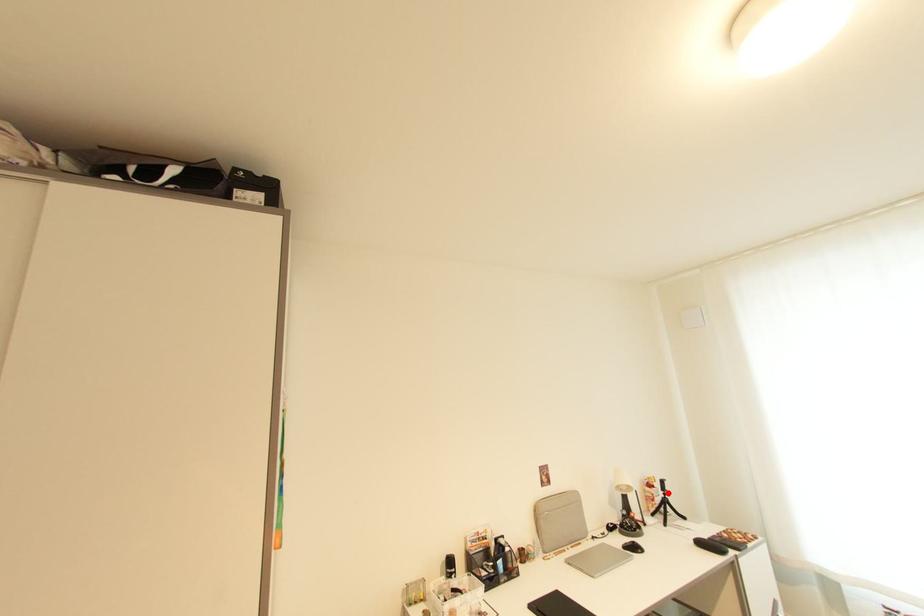
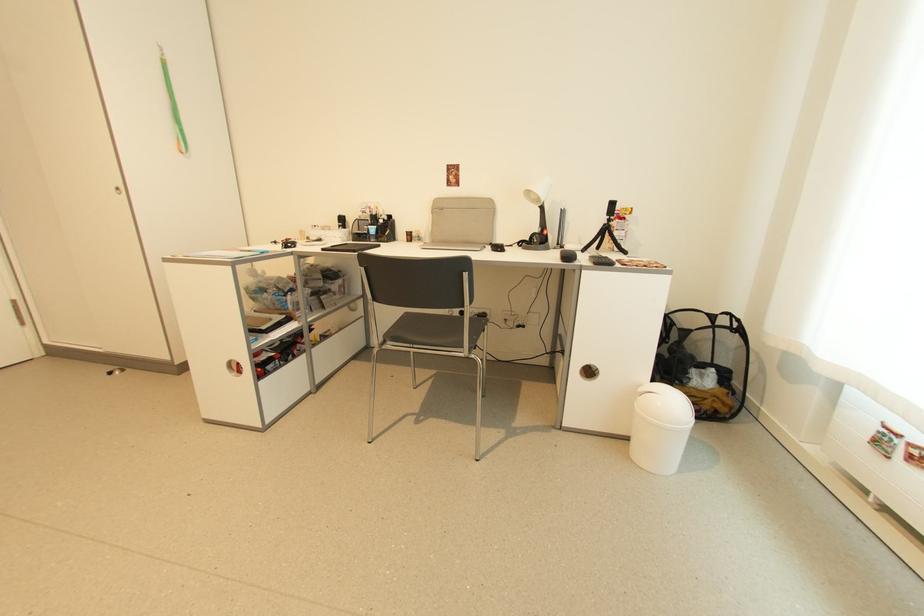
In the second image, find the point that corresponds to the highlighted location in the first image.

(612, 217)